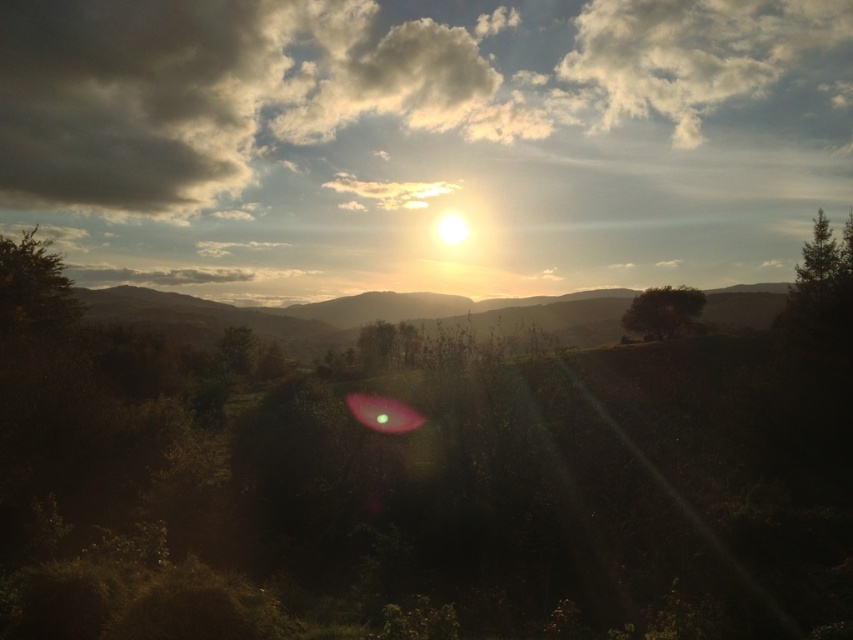
Question: Estimate the real-world distances between objects in this image. Which object is closer to the cloudy sky at center?

Choices:
 (A) green matte tree at upper right
 (B) green matte tree at right
 (C) green leafy tree at left

Answer: (A)

Question: Estimate the real-world distances between objects in this image. Which object is farther from the green leafy tree at left?

Choices:
 (A) green matte tree at upper right
 (B) green leafy tree at center

Answer: (B)

Question: Is green matte tree at right further to camera compared to green leafy tree at center?

Choices:
 (A) yes
 (B) no

Answer: (B)

Question: Is cloudy sky at center further to the viewer compared to green leafy tree at center?

Choices:
 (A) yes
 (B) no

Answer: (A)

Question: Is green leafy tree at center thinner than green matte tree at upper right?

Choices:
 (A) no
 (B) yes

Answer: (B)

Question: Which point appears closest to the camera in this image?

Choices:
 (A) pyautogui.click(x=48, y=280)
 (B) pyautogui.click(x=811, y=278)
 (C) pyautogui.click(x=811, y=259)

Answer: (B)